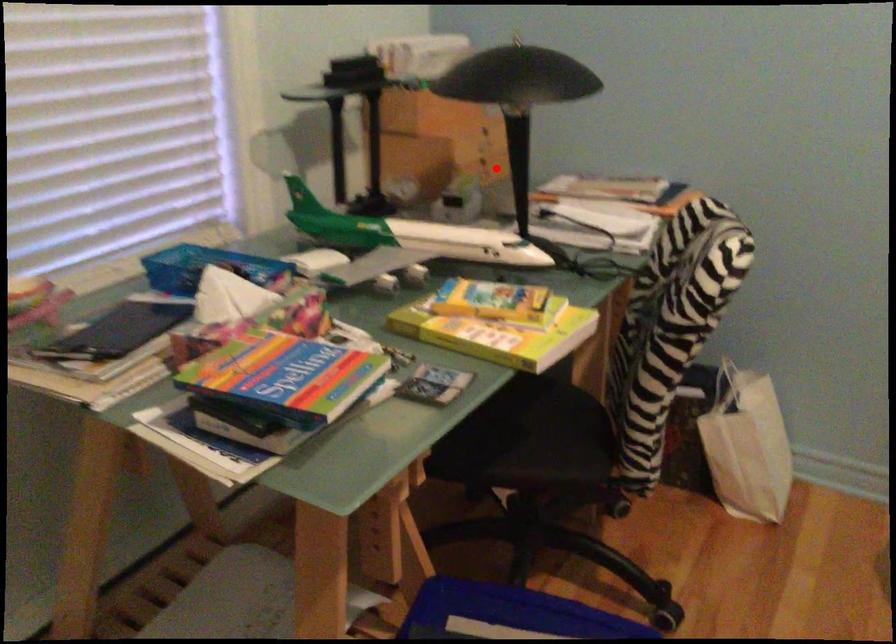
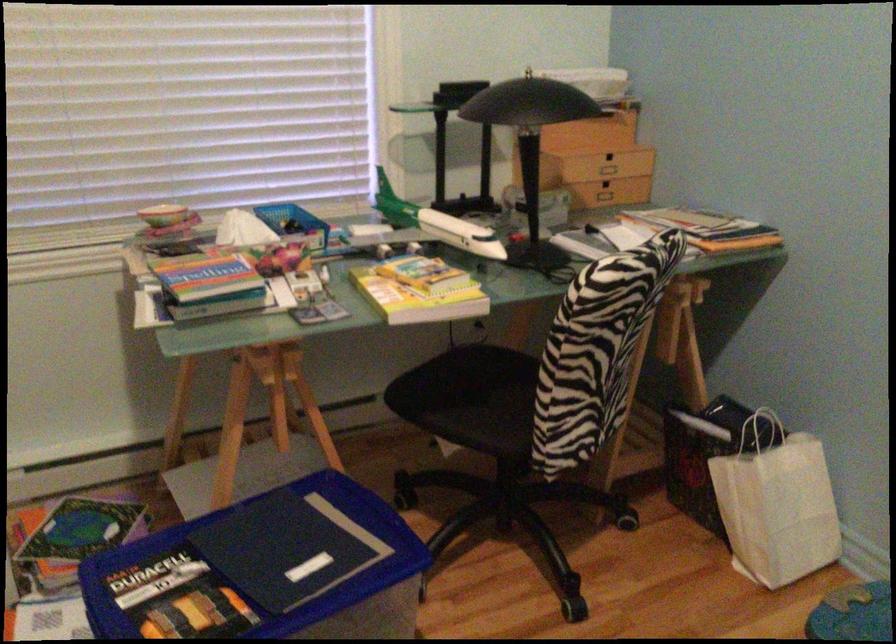
Question: I am providing you with two images of the same scene from different viewpoints. A red point is marked on the first image. At the location where the point appears in image 1, is it still visible in image 2?

Choices:
 (A) Yes
 (B) No

Answer: (A)